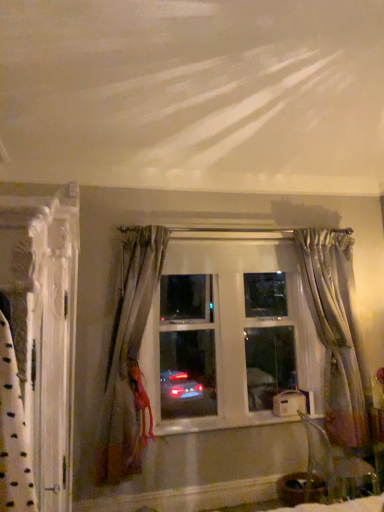
Question: Relative to clear glass window at center, is satin gray curtain at left, the second curtain in the left-to-right sequence, in front or behind?

Choices:
 (A) front
 (B) behind

Answer: (A)

Question: Considering the positions of point (127, 355) and point (208, 289), is point (127, 355) closer or farther from the camera than point (208, 289)?

Choices:
 (A) farther
 (B) closer

Answer: (B)

Question: Based on their relative distances, which object is nearer to the white painted wood at center?

Choices:
 (A) satin gray curtain at left, the 2th curtain positioned from the right
 (B) silvery sheer curtain at right, the first curtain when ordered from right to left
 (C) white textured curtain at left, acting as the third curtain starting from the back
 (D) clear glass window at center

Answer: (A)

Question: Considering the real-world distances, which object is farthest from the clear glass window at center?

Choices:
 (A) white painted wood at center
 (B) silvery sheer curtain at right, which appears as the 3th curtain when viewed from the left
 (C) white textured curtain at left, which appears as the 3th curtain when viewed from the right
 (D) satin gray curtain at left, the second curtain in the left-to-right sequence

Answer: (C)